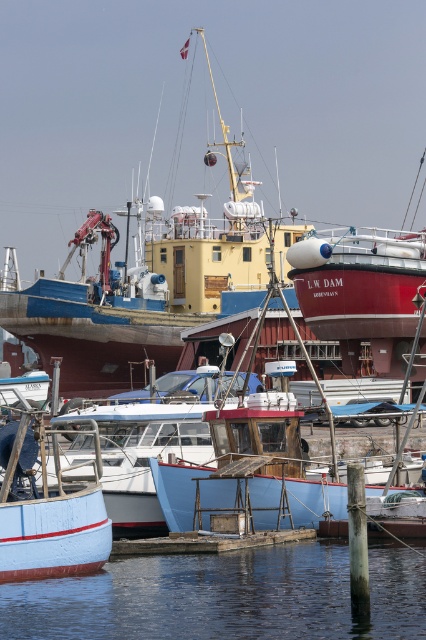
You are a crane operator on the yellow matte ship at center. You need to lower a heavy crate into the transparent water at lower center. Can you safely lower it without hitting the ship?

The yellow matte ship at center is much taller than the transparent water at lower center, so lowering the crate into the transparent water at lower center would require careful maneuvering to avoid the ship itself. However, since the ship is taller, there might be sufficient vertical clearance if the water is deep enough. Check the water depth before proceeding.

You are a harbor worker who needs to secure a large cargo container onto the yellow matte ship at center. Considering the size of the ship and the transparent water at lower center, will there be enough space on the ship to accommodate the container?

The yellow matte ship at center has a larger size compared to transparent water at lower center, so there should be sufficient space to accommodate the cargo container on the ship.

You are standing on the pier and want to board the yellow matte ship at center. If your walking speed is 3 feet per second, how many seconds will it take you to reach the ship?

The yellow matte ship at center is 405.02 feet away from the viewer. At a walking speed of 3 feet per second, it would take approximately 135 seconds to reach the ship.